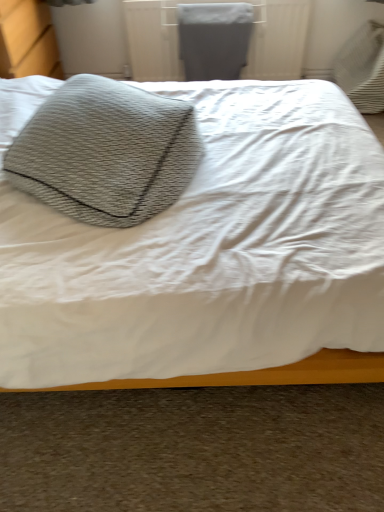
Question: Is textured gray pillow at upper left at the back of matte gray radiator at upper center?

Choices:
 (A) yes
 (B) no

Answer: (B)

Question: Does matte gray radiator at upper center have a larger size compared to textured gray pillow at upper left?

Choices:
 (A) no
 (B) yes

Answer: (A)

Question: Does matte gray radiator at upper center touch textured gray pillow at upper left?

Choices:
 (A) yes
 (B) no

Answer: (B)

Question: Does matte gray radiator at upper center have a lesser width compared to textured gray pillow at upper left?

Choices:
 (A) no
 (B) yes

Answer: (B)

Question: Is matte gray radiator at upper center not within textured gray pillow at upper left?

Choices:
 (A) no
 (B) yes

Answer: (B)

Question: Does matte gray radiator at upper center lie behind textured gray pillow at upper left?

Choices:
 (A) yes
 (B) no

Answer: (A)

Question: Can you confirm if textured gray pillow at upper left is bigger than textured gray pillow at upper left?

Choices:
 (A) no
 (B) yes

Answer: (A)

Question: Is textured gray pillow at upper left aimed at textured gray pillow at upper left?

Choices:
 (A) yes
 (B) no

Answer: (A)

Question: Does textured gray pillow at upper left have a lesser height compared to textured gray pillow at upper left?

Choices:
 (A) no
 (B) yes

Answer: (B)

Question: Does textured gray pillow at upper left have a smaller size compared to textured gray pillow at upper left?

Choices:
 (A) no
 (B) yes

Answer: (B)

Question: From the image's perspective, does textured gray pillow at upper left appear higher than textured gray pillow at upper left?

Choices:
 (A) no
 (B) yes

Answer: (B)

Question: Is textured gray pillow at upper left positioned beyond the bounds of textured gray pillow at upper left?

Choices:
 (A) no
 (B) yes

Answer: (A)

Question: Is textured gray pillow at upper left further to the viewer compared to textured gray pillow at upper left?

Choices:
 (A) yes
 (B) no

Answer: (B)